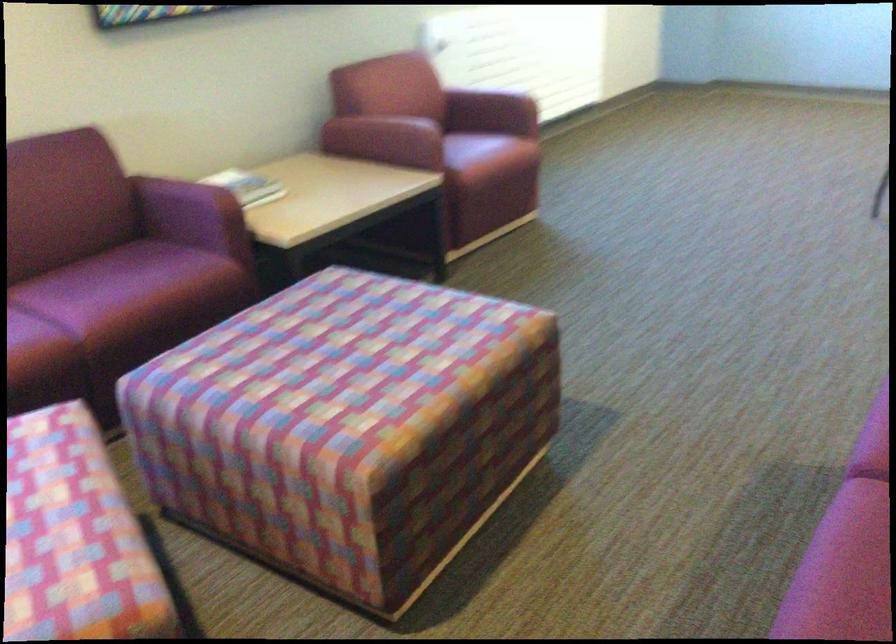
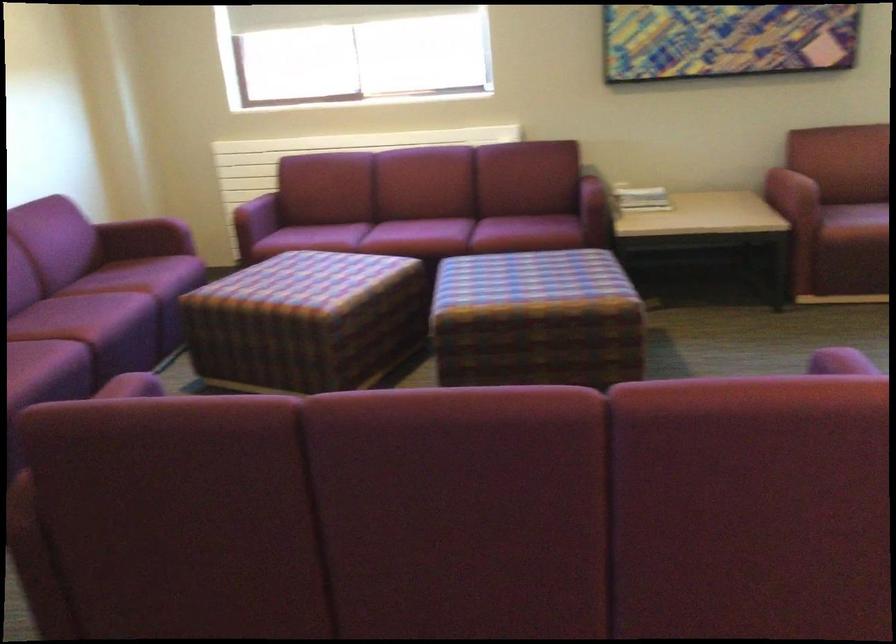
The point at (496, 401) is marked in the first image. Where is the corresponding point in the second image?

(536, 319)